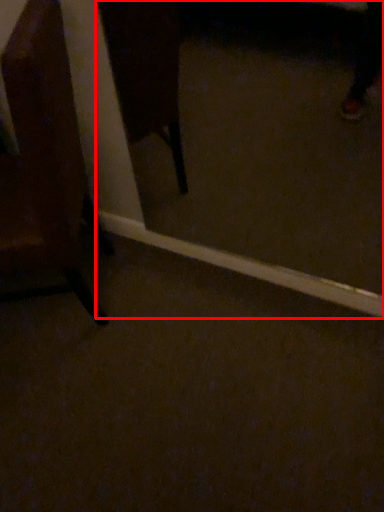
Question: From the image's perspective, considering the relative positions of glass door (annotated by the red box) and chair in the image provided, where is glass door (annotated by the red box) located with respect to the staircase?

Choices:
 (A) below
 (B) above

Answer: (B)